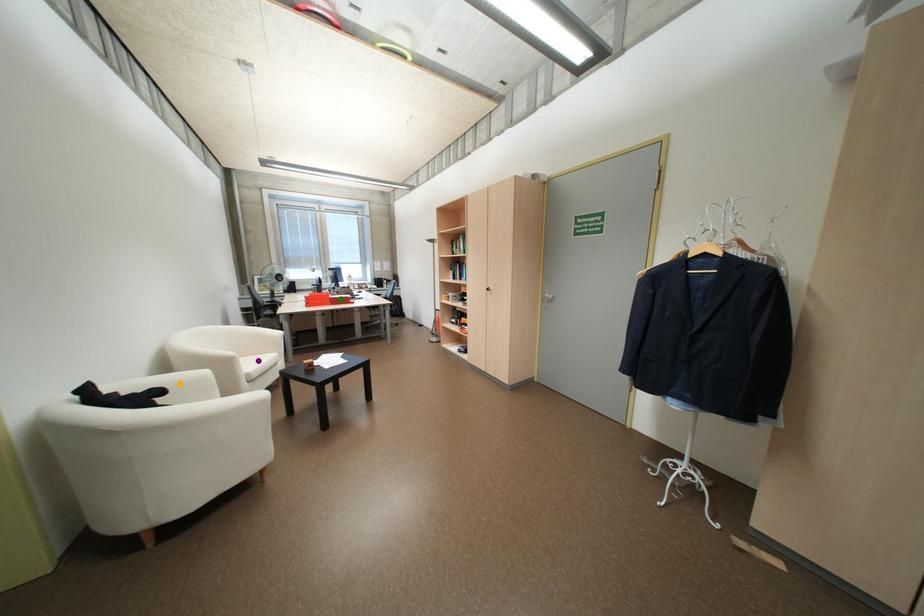
Order these from nearest to farthest:
A) purple point
B) orange point
C) green point

1. orange point
2. purple point
3. green point